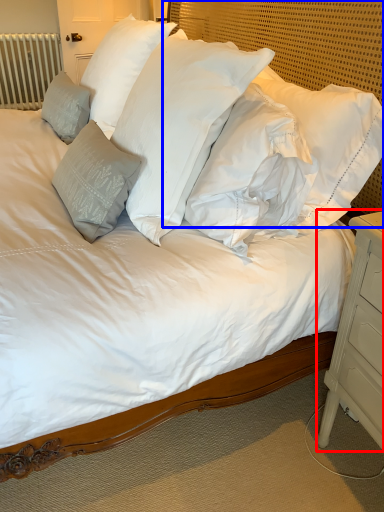
Question: Which object is closer to the camera taking this photo, nightstand (highlighted by a red box) or headboard (highlighted by a blue box)?

Choices:
 (A) nightstand
 (B) headboard

Answer: (A)